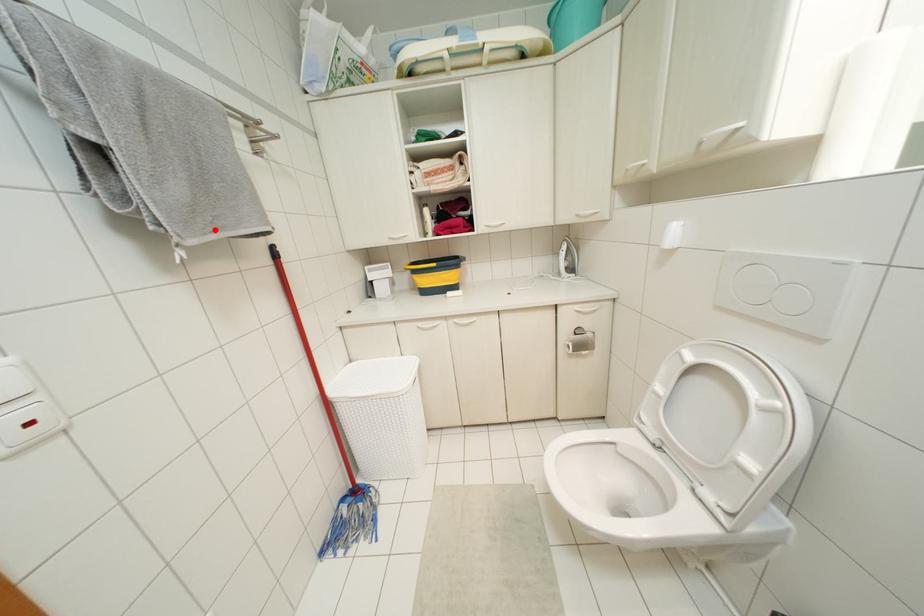
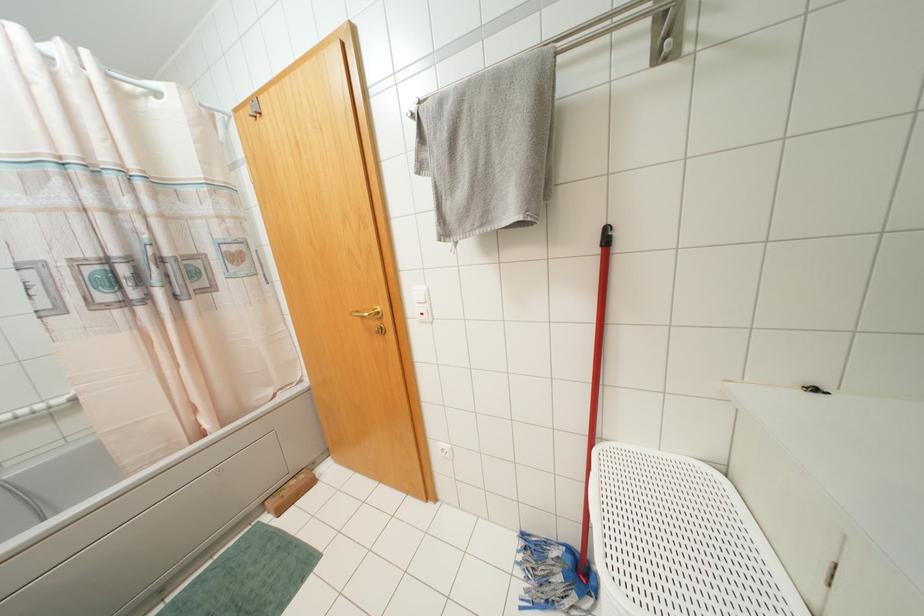
In the second image, find the point that corresponds to the highlighted location in the first image.

(481, 225)